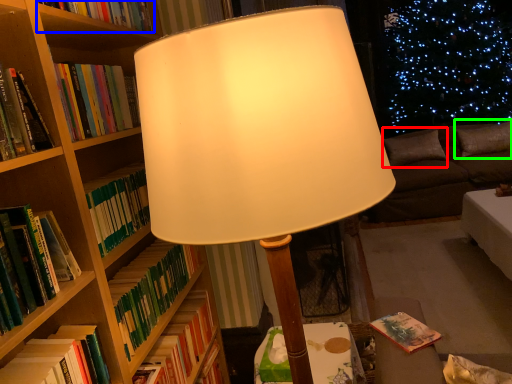
Question: Based on their relative distances, which object is farther from pillow (highlighted by a red box)? Choose from book (highlighted by a blue box) and pillow (highlighted by a green box).

Choices:
 (A) book
 (B) pillow

Answer: (A)